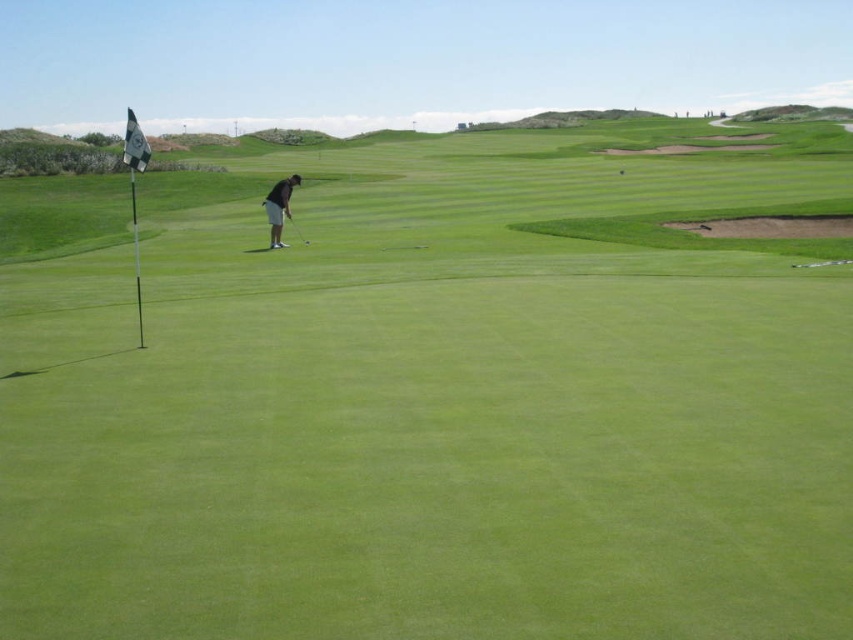
Question: Which of the following is the farthest from the observer?

Choices:
 (A) metallic silver golf club at center
 (B) dark gray pants at center

Answer: (A)

Question: Which point is closer to the camera?

Choices:
 (A) click(x=279, y=180)
 (B) click(x=296, y=225)

Answer: (A)

Question: Does dark gray pants at center appear on the right side of metallic silver golf club at center?

Choices:
 (A) no
 (B) yes

Answer: (A)

Question: Does dark gray pants at center come behind metallic silver golf club at center?

Choices:
 (A) no
 (B) yes

Answer: (A)

Question: Does dark gray pants at center appear on the left side of metallic silver golf club at center?

Choices:
 (A) no
 (B) yes

Answer: (B)